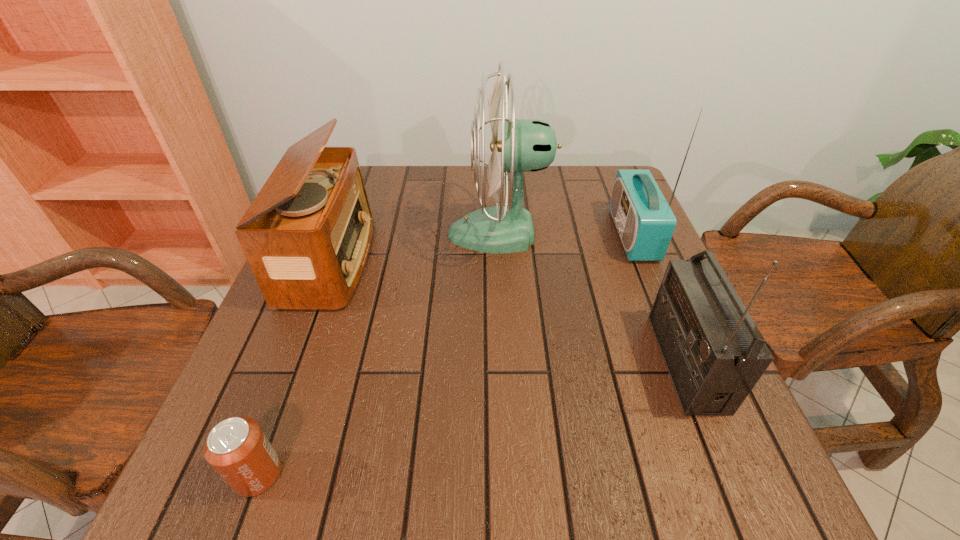
What are the coordinates of `free space located on the front panel of the nearest radio receiver` in the screenshot? It's located at (546, 362).

Locate an element on the screen. The image size is (960, 540). vacant space located on the front panel of the nearest radio receiver is located at coordinates (536, 362).

What are the coordinates of `vacant area situated on the front panel of the nearest radio receiver` in the screenshot? It's located at (482, 362).

At what (x,y) coordinates should I click in order to perform the action: click on free region located 0.400m on the front panel of the leftmost radio receiver. Please return your answer as a coordinate pair (x, y). This screenshot has width=960, height=540. Looking at the image, I should click on (538, 261).

Locate an element on the screen. The width and height of the screenshot is (960, 540). free space located 0.200m on the right of the shortest object is located at coordinates (412, 474).

This screenshot has height=540, width=960. I want to click on fan situated at the far edge, so click(527, 145).

This screenshot has width=960, height=540. In order to click on radio receiver present at the far edge in this screenshot , I will do pyautogui.click(x=645, y=222).

Find the location of `object that is at the near edge`. object that is at the near edge is located at coordinates (237, 448).

The height and width of the screenshot is (540, 960). In order to click on radio receiver that is positioned at the left edge in this screenshot , I will do `click(307, 234)`.

This screenshot has width=960, height=540. I want to click on can present at the left edge, so click(237, 448).